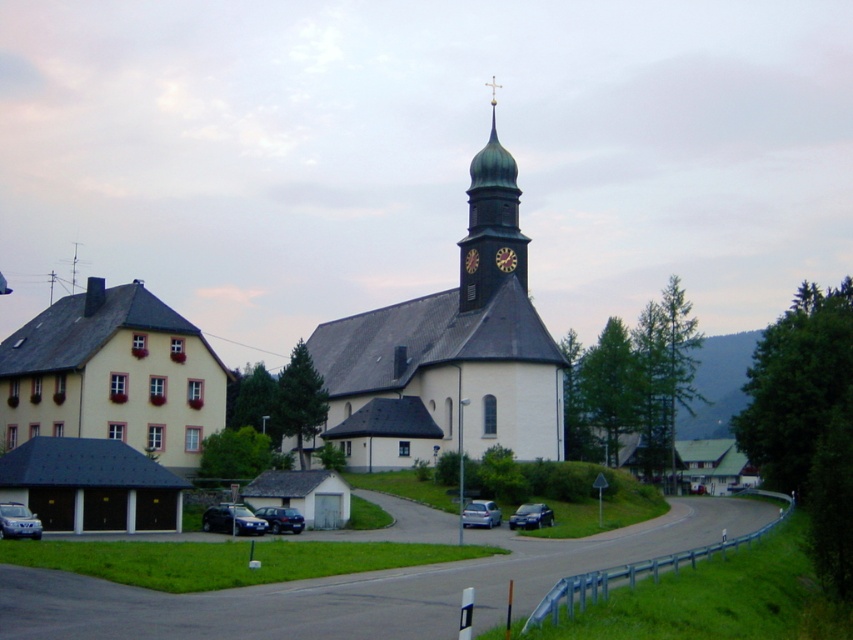
Between silver metallic sedan at lower center and metallic clock face at center, which one is positioned higher?

metallic clock face at center

Can you confirm if silver metallic sedan at lower center is thinner than metallic clock face at center?

No, silver metallic sedan at lower center is not thinner than metallic clock face at center.

Who is more distant from viewer, (x=474, y=524) or (x=508, y=262)?

Point (x=508, y=262)

Locate an element on the screen. silver metallic sedan at lower center is located at coordinates (480, 513).

Is green copper clock tower at center further to the viewer compared to silver metallic car at lower left?

Yes, it is.

From the picture: Who is shorter, green copper clock tower at center or silver metallic car at lower left?

With less height is silver metallic car at lower left.

You are a GUI agent. You are given a task and a screenshot of the screen. Output one action in this format:
    pyautogui.click(x=<x>, y=<y>)
    Task: Click on the green copper clock tower at center
    This screenshot has height=640, width=853.
    Given the screenshot: What is the action you would take?
    pyautogui.click(x=491, y=220)

Is metallic blue sedan at lower center shorter than dark brown wooden clock at center?

Indeed, metallic blue sedan at lower center has a lesser height compared to dark brown wooden clock at center.

Is point (276, 513) behind point (463, 268)?

No, (276, 513) is closer to viewer.

Identify the location of metallic blue sedan at lower center. (281, 518).